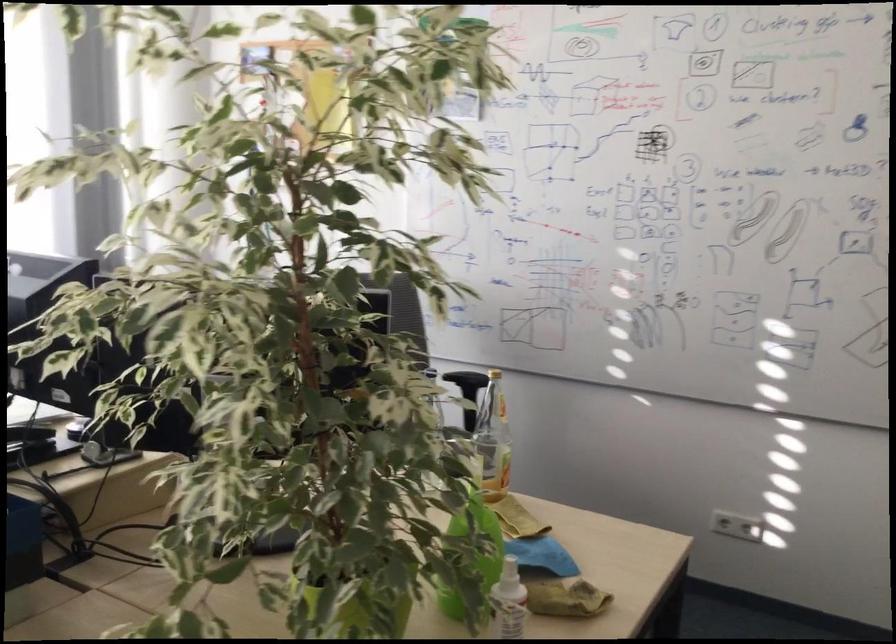
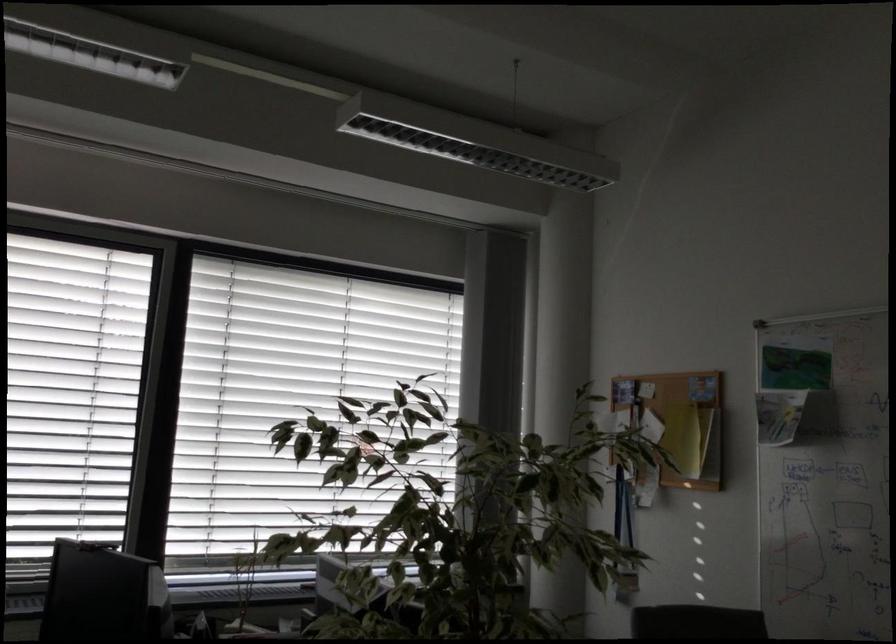
In the second image, find the point that corresponds to (442,211) in the first image.

(786, 538)